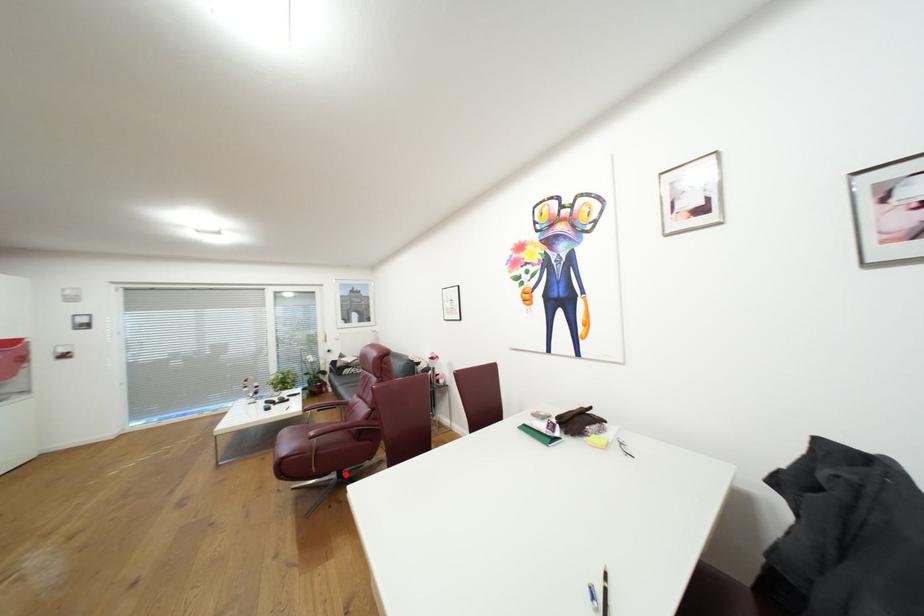
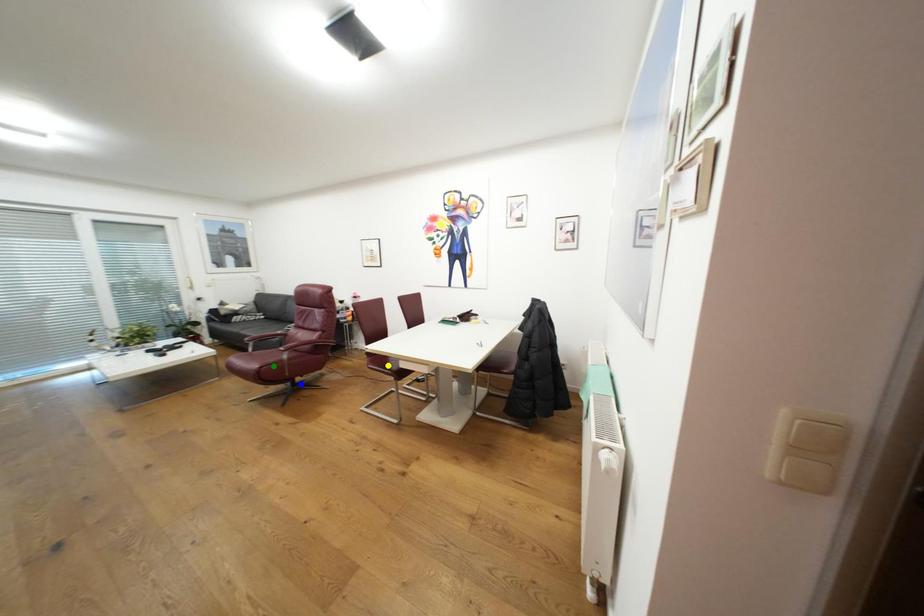
Question: I am providing you with two images of the same scene from different viewpoints. A red point is marked on the first image. You are given multiple points on the second image. Which point in image 2 represents the same 3d spot as the red point in image 1?

Choices:
 (A) yellow point
 (B) blue point
 (C) green point

Answer: (B)